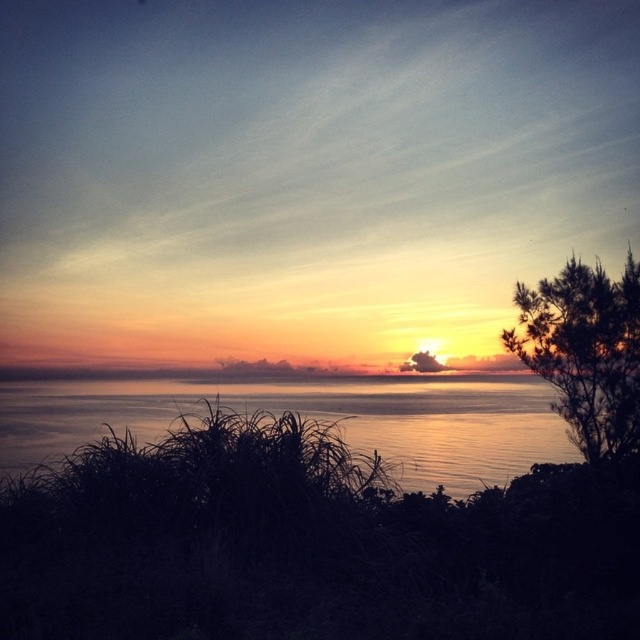
You are standing at the center of the image and want to reach the silky water at center. In which direction should you move?

The silky water at center is already at the center of the image, so you are already at the correct location.